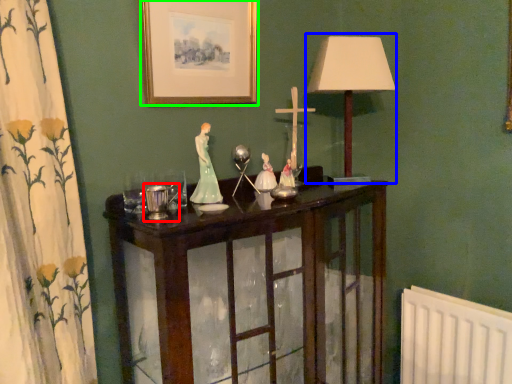
Question: Which object is positioned closest to candle holder (highlighted by a red box)? Select from table lamp (highlighted by a blue box) and picture frame (highlighted by a green box).

Choices:
 (A) table lamp
 (B) picture frame

Answer: (B)